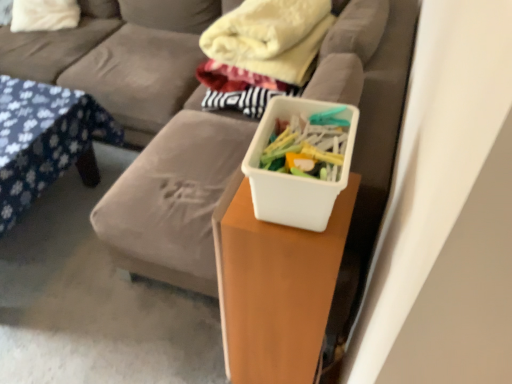
Question: Should I look upward or downward to see blue floral fabric at left?

Choices:
 (A) down
 (B) up

Answer: (B)

Question: Is soft yellow blanket at upper center turned away from soft gray couch at center?

Choices:
 (A) yes
 (B) no

Answer: (B)

Question: Is soft yellow blanket at upper center facing towards soft gray couch at center?

Choices:
 (A) no
 (B) yes

Answer: (A)

Question: Can you confirm if soft yellow blanket at upper center is positioned to the right of soft gray couch at center?

Choices:
 (A) no
 (B) yes

Answer: (B)

Question: Can you confirm if soft yellow blanket at upper center is wider than soft gray couch at center?

Choices:
 (A) no
 (B) yes

Answer: (A)

Question: Is soft yellow blanket at upper center outside of soft gray couch at center?

Choices:
 (A) no
 (B) yes

Answer: (B)

Question: Can you confirm if soft yellow blanket at upper center is taller than soft gray couch at center?

Choices:
 (A) no
 (B) yes

Answer: (A)

Question: Is soft yellow blanket at upper center positioned in front of blue floral fabric at left?

Choices:
 (A) no
 (B) yes

Answer: (A)

Question: Can you confirm if soft yellow blanket at upper center is smaller than blue floral fabric at left?

Choices:
 (A) yes
 (B) no

Answer: (A)

Question: Is soft yellow blanket at upper center taller than blue floral fabric at left?

Choices:
 (A) yes
 (B) no

Answer: (A)

Question: Considering the relative sizes of soft yellow blanket at upper center and blue floral fabric at left in the image provided, is soft yellow blanket at upper center thinner than blue floral fabric at left?

Choices:
 (A) yes
 (B) no

Answer: (A)

Question: Is soft yellow blanket at upper center facing away from blue floral fabric at left?

Choices:
 (A) no
 (B) yes

Answer: (A)

Question: From the image's perspective, is soft yellow blanket at upper center over blue floral fabric at left?

Choices:
 (A) no
 (B) yes

Answer: (B)

Question: Does white matte plastic container at center have a lesser width compared to white soft pillow at upper left?

Choices:
 (A) yes
 (B) no

Answer: (A)